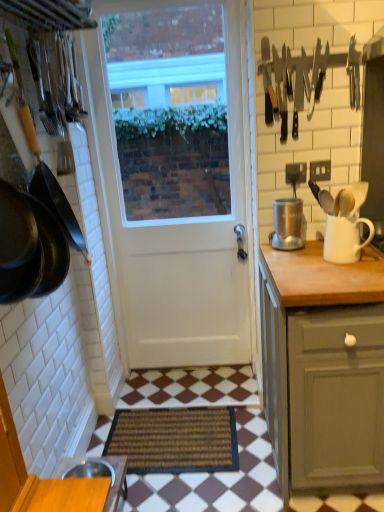
The width and height of the screenshot is (384, 512). Find the location of `free space in front of white glossy jug at right`. free space in front of white glossy jug at right is located at coordinates (346, 271).